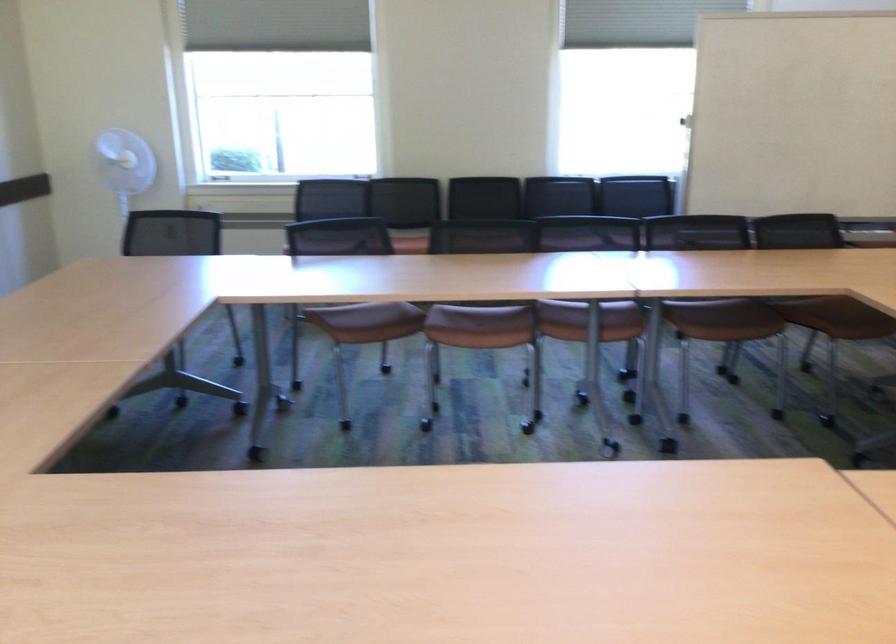
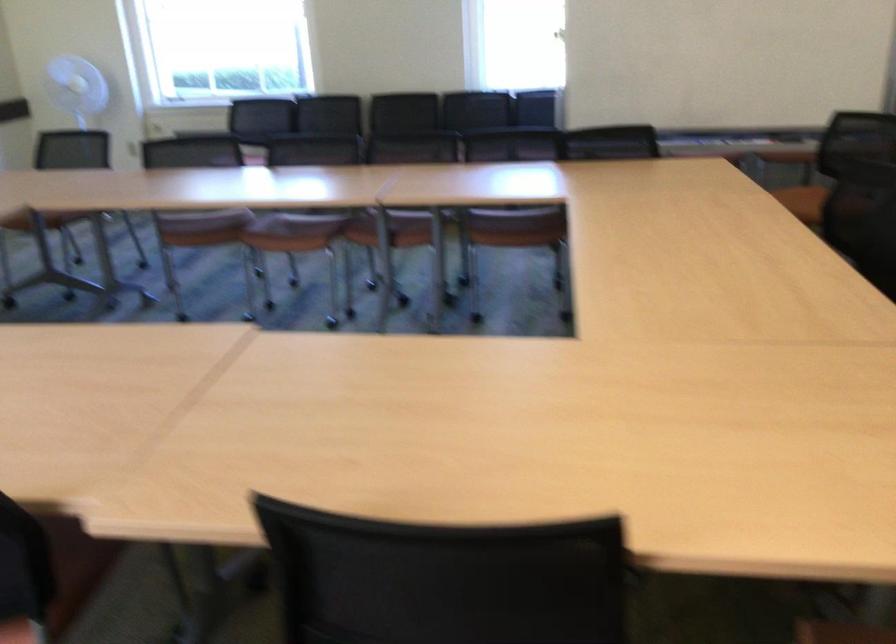
Locate, in the second image, the point that corresponds to the point at 369,328 in the first image.

(199, 227)